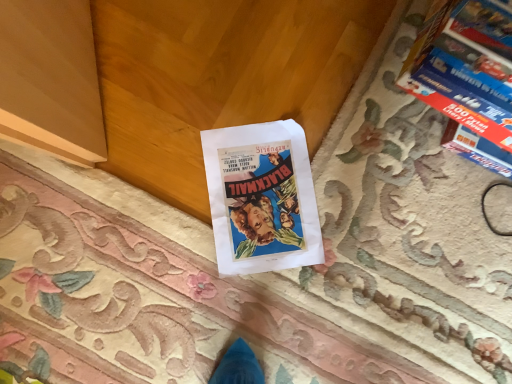
The image size is (512, 384). In order to click on vacant space underneath vintage paper poster at center (from a real-world perspective) in this screenshot , I will do `click(266, 195)`.